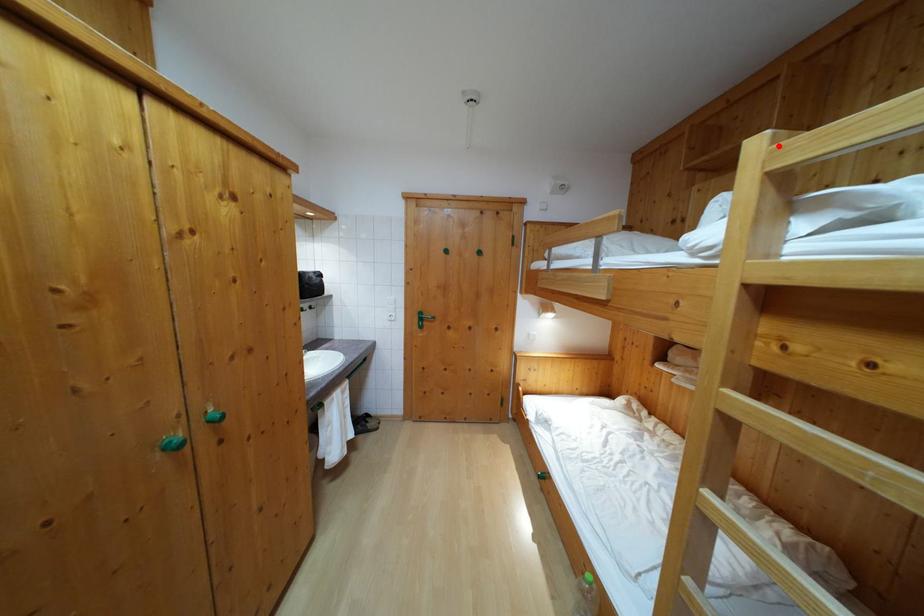
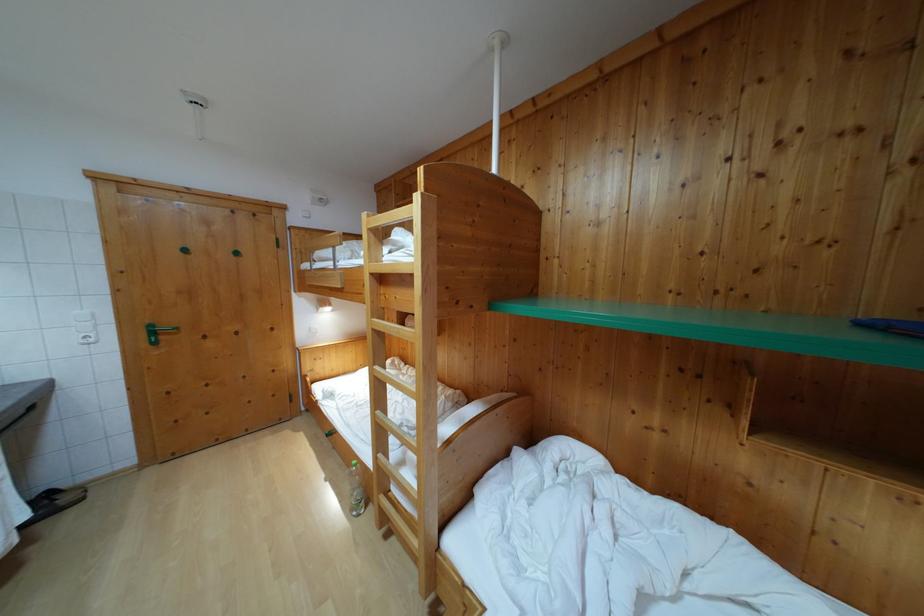
In the second image, find the point that corresponds to the highlighted location in the first image.

(371, 223)